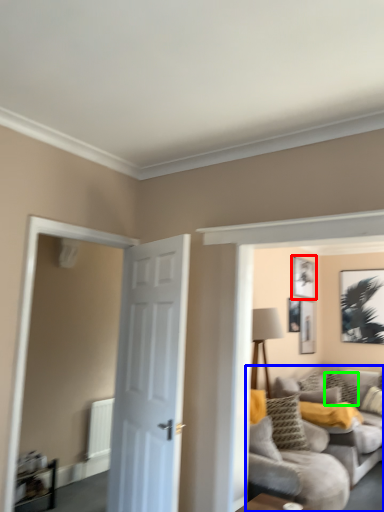
Question: Considering the real-world distances, which object is farthest from picture frame (highlighted by a red box)? studio couch (highlighted by a blue box) or pillow (highlighted by a green box)?

Choices:
 (A) studio couch
 (B) pillow

Answer: (A)